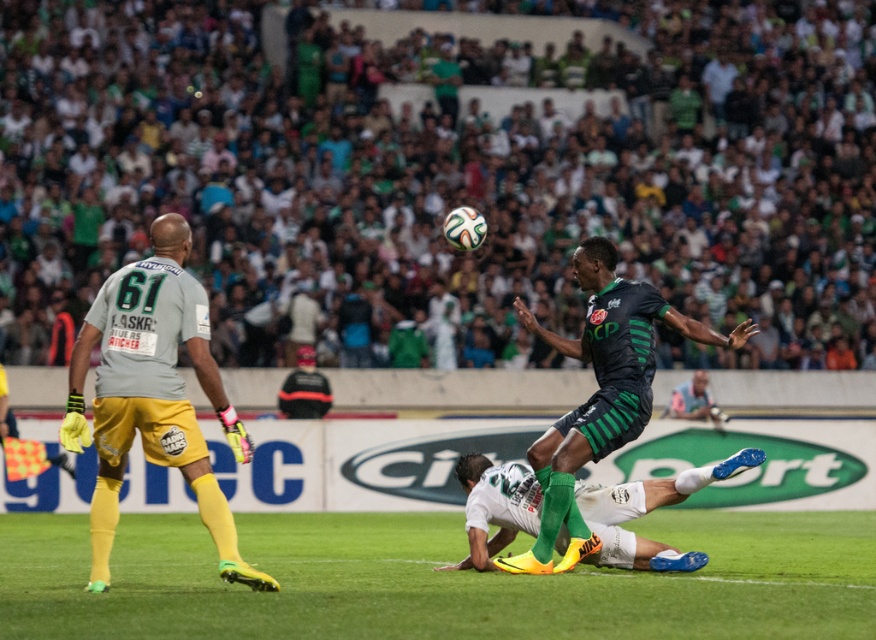
Does green grass at center have a greater width compared to white matte soccer ball at center?

Yes, green grass at center is wider than white matte soccer ball at center.

Which is behind, point (617, 605) or point (604, 538)?

The point (604, 538) is more distant.

I want to click on green grass at center, so click(x=435, y=580).

Describe the element at coordinates (435, 580) in the screenshot. I see `green grass at center` at that location.

Can you confirm if green grass at center is bigger than black matte soccer player at center?

Correct, green grass at center is larger in size than black matte soccer player at center.

Measure the distance between green grass at center and camera.

The distance of green grass at center from camera is 33.54 feet.

Where is `green grass at center`? green grass at center is located at coordinates coord(435,580).

Is matte gray jersey at left to the left of black matte soccer player at center from the viewer's perspective?

Indeed, matte gray jersey at left is positioned on the left side of black matte soccer player at center.

Does matte gray jersey at left have a smaller size compared to black matte soccer player at center?

Yes, matte gray jersey at left is smaller than black matte soccer player at center.

Is point (83, 360) closer to viewer compared to point (569, 560)?

Yes, it is in front of point (569, 560).

This screenshot has height=640, width=876. In order to click on matte gray jersey at left in this screenshot , I will do `click(153, 394)`.